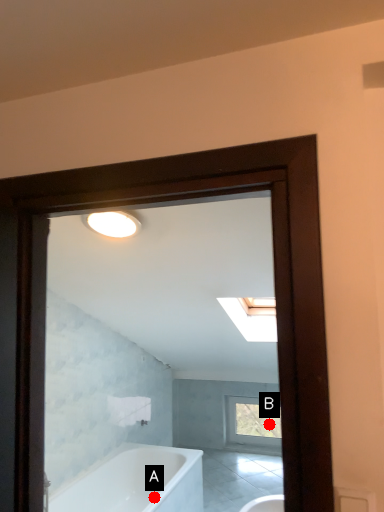
Question: Two points are circled on the image, labeled by A and B beside each circle. Which of the following is the closest to the observer?

Choices:
 (A) A is closer
 (B) B is closer

Answer: (A)